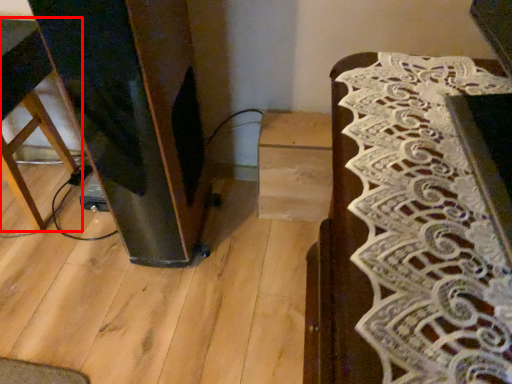
Question: From the image's perspective, what is the correct spatial relationship of furniture (annotated by the red box) in relation to furniture?

Choices:
 (A) above
 (B) below

Answer: (A)